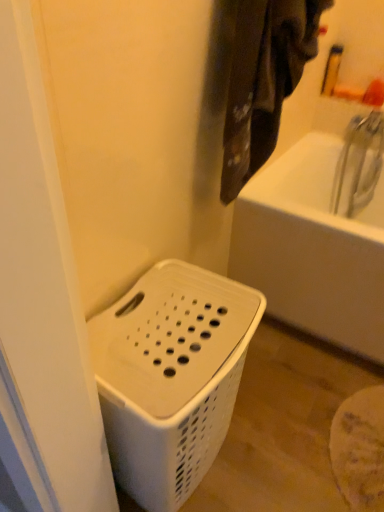
The image size is (384, 512). What do you see at coordinates (171, 377) in the screenshot? I see `white plastic basket at lower left` at bounding box center [171, 377].

This screenshot has height=512, width=384. I want to click on white plastic basket at lower left, so click(x=171, y=377).

This screenshot has height=512, width=384. Find the location of `white plastic laundry basket at upper right`. white plastic laundry basket at upper right is located at coordinates (264, 81).

Describe the element at coordinates (264, 81) in the screenshot. The width and height of the screenshot is (384, 512). I see `white plastic laundry basket at upper right` at that location.

This screenshot has height=512, width=384. Find the location of `white plastic basket at lower left`. white plastic basket at lower left is located at coordinates (171, 377).

Would you say white plastic basket at lower left is to the left or to the right of white plastic laundry basket at upper right in the picture?

From the image, it's evident that white plastic basket at lower left is to the left of white plastic laundry basket at upper right.

Is white plastic basket at lower left positioned in front of white plastic laundry basket at upper right?

That is True.

Between point (149, 372) and point (241, 150), which one is positioned behind?

The point (241, 150) is behind.

From the image's perspective, which one is positioned higher, white plastic basket at lower left or white plastic laundry basket at upper right?

From the image's view, white plastic laundry basket at upper right is above.

From the picture: From a real-world perspective, is white plastic basket at lower left under white plastic laundry basket at upper right?

Correct, in the physical world, white plastic basket at lower left is lower than white plastic laundry basket at upper right.

Looking at their sizes, would you say white plastic basket at lower left is wider or thinner than white plastic laundry basket at upper right?

In the image, white plastic basket at lower left appears to be wider than white plastic laundry basket at upper right.

Who is taller, white plastic basket at lower left or white plastic laundry basket at upper right?

With more height is white plastic basket at lower left.

Looking at the image, does white plastic basket at lower left seem bigger or smaller compared to white plastic laundry basket at upper right?

Clearly, white plastic basket at lower left is larger in size than white plastic laundry basket at upper right.

Can we say white plastic basket at lower left lies outside white plastic laundry basket at upper right?

Indeed, white plastic basket at lower left is completely outside white plastic laundry basket at upper right.

Is white plastic basket at lower left placed right next to white plastic laundry basket at upper right?

No, white plastic basket at lower left is not next to white plastic laundry basket at upper right.

Based on the photo, is white plastic laundry basket at upper right at the back of white plastic basket at lower left?

No, white plastic basket at lower left is not facing the opposite direction of white plastic laundry basket at upper right.

Consider the image. Can you tell me how much white plastic basket at lower left and white plastic laundry basket at upper right differ in facing direction?

The facing directions of white plastic basket at lower left and white plastic laundry basket at upper right are 0.95 degrees apart.

The height and width of the screenshot is (512, 384). Find the location of `laundry that appears above the white plastic basket at lower left (from a real-world perspective)`. laundry that appears above the white plastic basket at lower left (from a real-world perspective) is located at coordinates (264, 81).

Considering the positions of objects white plastic laundry basket at upper right and white plastic basket at lower left in the image provided, who is more to the left, white plastic laundry basket at upper right or white plastic basket at lower left?

Positioned to the left is white plastic basket at lower left.

Considering their positions, is white plastic laundry basket at upper right located in front of or behind white plastic basket at lower left?

Visually, white plastic laundry basket at upper right is located behind white plastic basket at lower left.

Which is farther from the camera, (267, 95) or (228, 279)?

Point (228, 279)

From the image's perspective, who appears lower, white plastic laundry basket at upper right or white plastic basket at lower left?

white plastic basket at lower left.

From a real-world perspective, which is physically below, white plastic laundry basket at upper right or white plastic basket at lower left?

In real-world perspective, white plastic basket at lower left is lower.

Which of these two, white plastic laundry basket at upper right or white plastic basket at lower left, is thinner?

Thinner between the two is white plastic laundry basket at upper right.

Based on the photo, is white plastic laundry basket at upper right shorter than white plastic basket at lower left?

Correct, white plastic laundry basket at upper right is not as tall as white plastic basket at lower left.

Is white plastic laundry basket at upper right bigger than white plastic basket at lower left?

No.

Is white plastic laundry basket at upper right positioned beyond the bounds of white plastic basket at lower left?

That's correct, white plastic laundry basket at upper right is outside of white plastic basket at lower left.

Can you see white plastic laundry basket at upper right touching white plastic basket at lower left?

white plastic laundry basket at upper right and white plastic basket at lower left are not in contact.

Is white plastic laundry basket at upper right looking in the opposite direction of white plastic basket at lower left?

No.

How different are the orientations of white plastic laundry basket at upper right and white plastic basket at lower left in degrees?

0.95 degrees.

There is a white plastic basket at lower left. Identify the location of laundry above it (from a real-world perspective). Image resolution: width=384 pixels, height=512 pixels. (264, 81).

I want to click on laundry that appears on the right of white plastic basket at lower left, so [x=264, y=81].

Image resolution: width=384 pixels, height=512 pixels. In order to click on laundry that is above the white plastic basket at lower left (from the image's perspective) in this screenshot , I will do `click(264, 81)`.